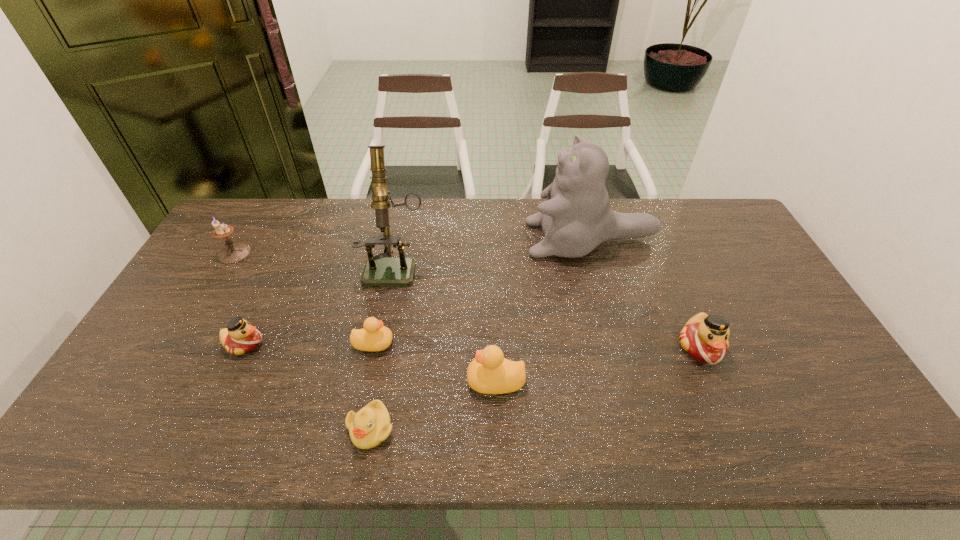
I want to click on the left yellow duck, so click(x=374, y=336).

What are the coordinates of `the smaller yellow duck` in the screenshot? It's located at (374, 336).

Where is `duckling`? The width and height of the screenshot is (960, 540). duckling is located at coordinates (371, 425).

Image resolution: width=960 pixels, height=540 pixels. What are the coordinates of `yellow duckling` in the screenshot? It's located at (x=371, y=425).

Find the location of a particular element. This screenshot has height=540, width=960. free space located at the eyepiece of the microscope is located at coordinates (379, 355).

Identify the location of vacant space located on the face of the cat. This screenshot has height=540, width=960. (468, 239).

Locate an element on the screen. vacant space positioned 0.200m on the face of the cat is located at coordinates (468, 239).

Locate an element on the screen. The image size is (960, 540). vacant area located 0.110m on the face of the cat is located at coordinates (494, 239).

Identify the location of free region located on the right of the purple candle holder. (369, 253).

Where is `blank area located 0.090m on the face of the rightmost duck`? blank area located 0.090m on the face of the rightmost duck is located at coordinates (724, 401).